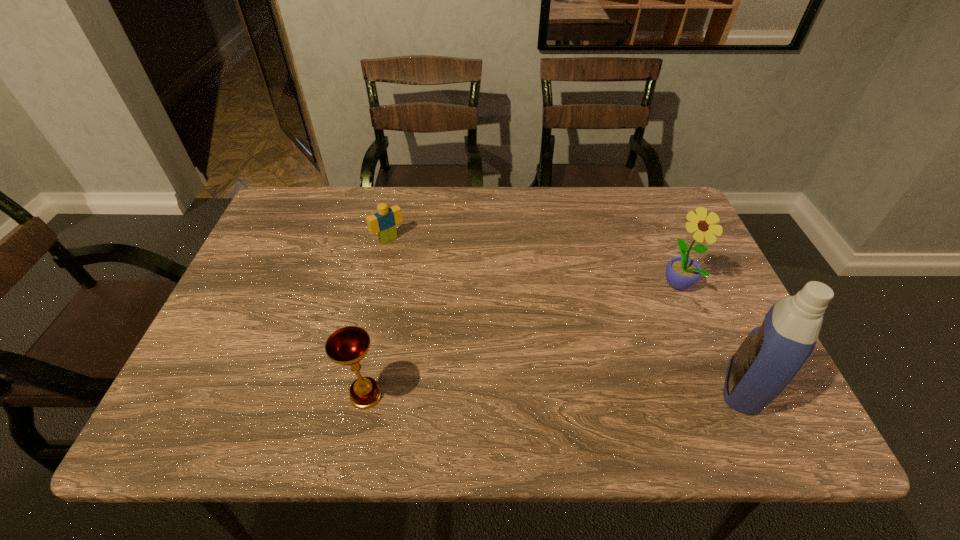
Find the location of `vacant spot on the desktop that is between the third tallest object and the detergent and is positioned on the face of the farthest object`. vacant spot on the desktop that is between the third tallest object and the detergent and is positioned on the face of the farthest object is located at coordinates [525, 392].

Image resolution: width=960 pixels, height=540 pixels. I want to click on vacant space on the desktop that is between the chalice and the detergent and is positioned on the front-facing side of the second farthest object, so click(x=523, y=392).